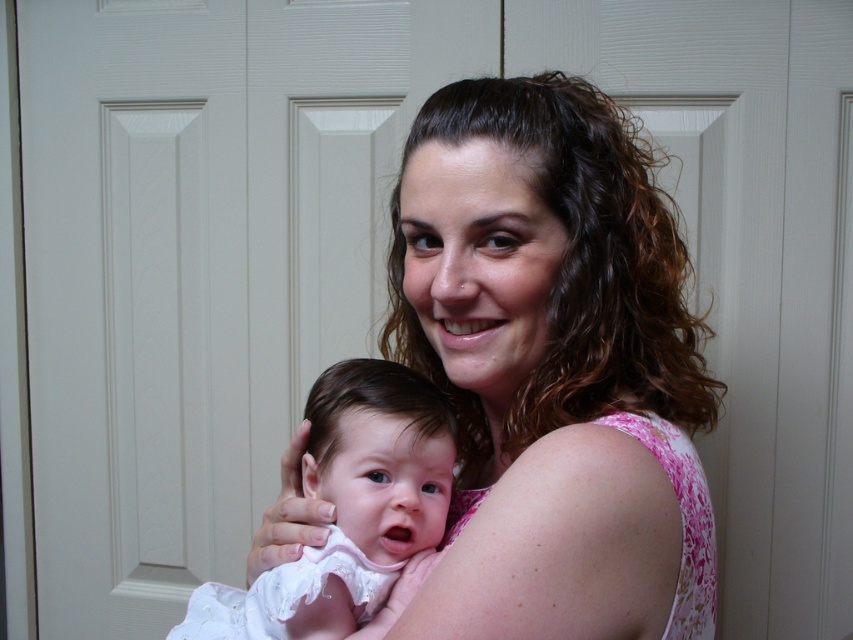
You are a photographer setting up for a family portrait. You need to ensure that both the pink floral dress at center and the white soft fabric baby at center are clearly visible in the photo. Given their size difference, which object should you focus on first to ensure proper exposure?

The pink floral dress at center is larger than the white soft fabric baby at center, so you should focus on the pink floral dress at center first to ensure proper exposure, as larger objects may require more light adjustment.

You are a photographer standing at the point marked by the coordinate point at point (532, 376). You want to take a photo of the woman holding the baby so that both are in focus. The camera you are using has a depth of field that can cover 25 inches. Will you be able to capture both subjects clearly in the same shot?

The distance between the photographer at point (532, 376) and the woman holding the baby is 26.45 inches. Since the camera can only cover 25 inches, the depth of field is insufficient to keep both subjects in focus. You will need to adjust your position or use a different camera setting to ensure both are in focus.

Looking at the scene, where is the pink floral dress at center in relation to the white soft fabric baby at center?

The pink floral dress at center is to the right of the white soft fabric baby at center.